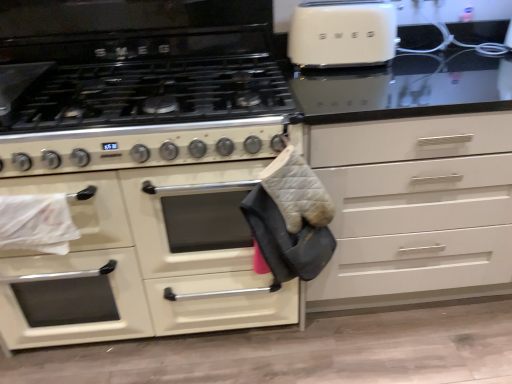
Question: Do you think white matte drawer at center is within gray quilted oven mitt at center, or outside of it?

Choices:
 (A) inside
 (B) outside

Answer: (B)

Question: Relative to gray quilted oven mitt at center, is white matte drawer at center in front or behind?

Choices:
 (A) behind
 (B) front

Answer: (A)

Question: Considering the real-world distances, which object is farthest from the matte white oven at center?

Choices:
 (A) gray quilted oven mitt at center
 (B) white matte drawer at center

Answer: (B)

Question: Estimate the real-world distances between objects in this image. Which object is closer to the matte white oven at center?

Choices:
 (A) white matte drawer at center
 (B) gray quilted oven mitt at center

Answer: (B)